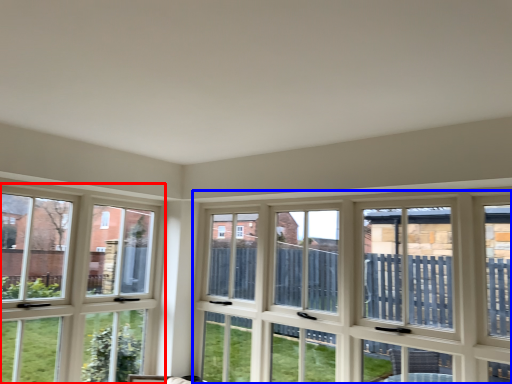
Question: Which of the following is the farthest to the observer, window (highlighted by a red box) or window (highlighted by a blue box)?

Choices:
 (A) window
 (B) window

Answer: (A)